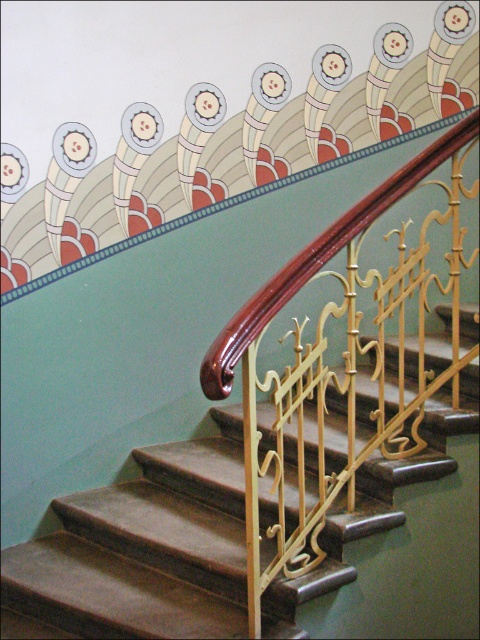
In the scene shown: Between brown leather stairs at center and glossy wood handrail at upper center, which one is positioned higher?

glossy wood handrail at upper center

From the picture: Is brown leather stairs at center shorter than glossy wood handrail at upper center?

In fact, brown leather stairs at center may be taller than glossy wood handrail at upper center.

Who is more distant from viewer, (432, 426) or (233, 326)?

Point (432, 426)

Locate an element on the screen. This screenshot has height=640, width=480. brown leather stairs at center is located at coordinates (142, 550).